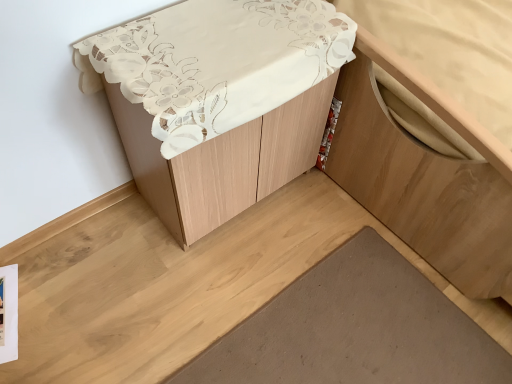
Question: Are brown matte wood plank at lower center and matte white cabinet at center far apart?

Choices:
 (A) no
 (B) yes

Answer: (A)

Question: Is brown matte wood plank at lower center aimed at matte white cabinet at center?

Choices:
 (A) yes
 (B) no

Answer: (A)

Question: Can you confirm if brown matte wood plank at lower center is wider than matte white cabinet at center?

Choices:
 (A) yes
 (B) no

Answer: (A)

Question: From the image's perspective, is brown matte wood plank at lower center located beneath matte white cabinet at center?

Choices:
 (A) no
 (B) yes

Answer: (B)

Question: Does brown matte wood plank at lower center appear on the left side of matte white cabinet at center?

Choices:
 (A) yes
 (B) no

Answer: (B)

Question: In terms of height, does matte white cabinet at center look taller or shorter compared to wooden cabinet at lower right?

Choices:
 (A) tall
 (B) short

Answer: (A)

Question: Considering the positions of point (x=306, y=140) and point (x=368, y=188), is point (x=306, y=140) closer or farther from the camera than point (x=368, y=188)?

Choices:
 (A) farther
 (B) closer

Answer: (B)

Question: From the image's perspective, is matte white cabinet at center located above or below wooden cabinet at lower right?

Choices:
 (A) below
 (B) above

Answer: (A)

Question: Looking at the image, does matte white cabinet at center seem bigger or smaller compared to wooden cabinet at lower right?

Choices:
 (A) small
 (B) big

Answer: (A)

Question: Would you say brown matte wood plank at lower center is to the left or to the right of wooden cabinet at lower right in the picture?

Choices:
 (A) left
 (B) right

Answer: (A)

Question: In terms of size, does brown matte wood plank at lower center appear bigger or smaller than wooden cabinet at lower right?

Choices:
 (A) small
 (B) big

Answer: (A)

Question: Is brown matte wood plank at lower center inside the boundaries of wooden cabinet at lower right, or outside?

Choices:
 (A) outside
 (B) inside

Answer: (A)

Question: Considering the positions of point (266, 327) and point (349, 139), is point (266, 327) closer or farther from the camera than point (349, 139)?

Choices:
 (A) closer
 (B) farther

Answer: (A)

Question: From the image's perspective, is matte white cabinet at center above or below brown matte wood plank at lower center?

Choices:
 (A) above
 (B) below

Answer: (A)

Question: In terms of width, does matte white cabinet at center look wider or thinner when compared to brown matte wood plank at lower center?

Choices:
 (A) thin
 (B) wide

Answer: (A)